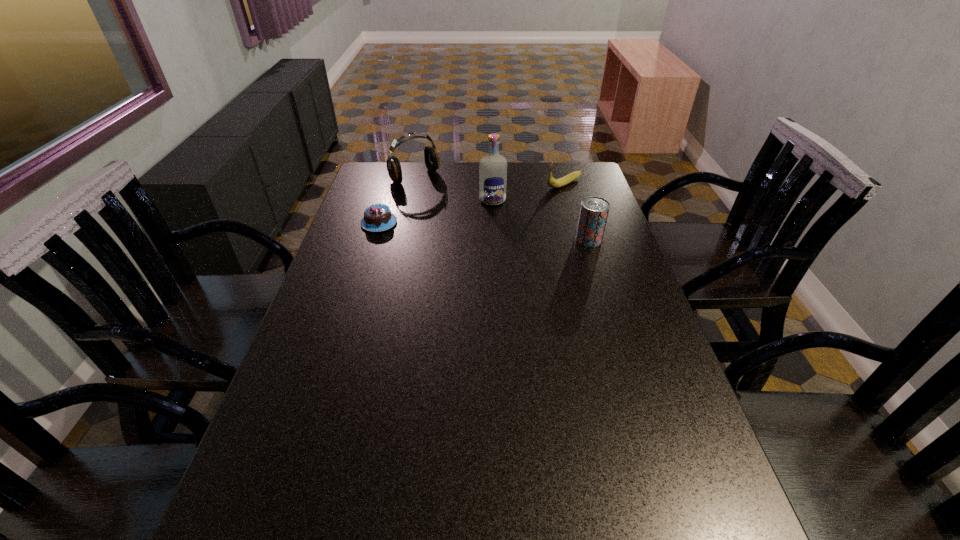
Find the location of a particular element. free point located on the ear cups of the second tallest object is located at coordinates (x=465, y=215).

Locate an element on the screen. This screenshot has width=960, height=540. vacant space located 0.070m on the label of the tallest object is located at coordinates (495, 218).

Identify the location of vacant area located on the label of the tallest object. (495, 215).

Where is `vacant position located 0.290m on the label of the tallest object`? vacant position located 0.290m on the label of the tallest object is located at coordinates click(x=503, y=259).

Locate an element on the screen. vacant space located 0.150m at the stem of the banana is located at coordinates (520, 202).

Identify the location of free space located 0.240m at the stem of the banana. (501, 210).

Where is `vacant point located at the stem of the banana`? vacant point located at the stem of the banana is located at coordinates (464, 226).

Identify the location of headset that is positioned at the far edge. The width and height of the screenshot is (960, 540). (432, 161).

The image size is (960, 540). I want to click on banana positioned at the far edge, so click(x=552, y=182).

Identify the location of chocolate cake located at the left edge. (377, 217).